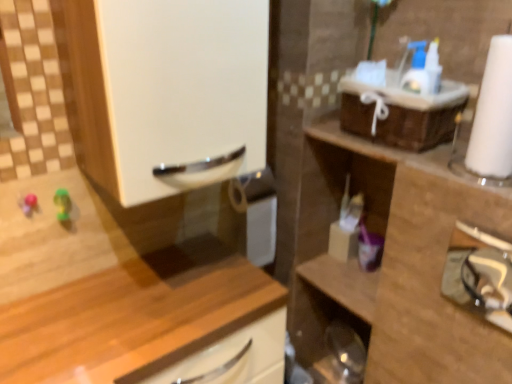
I want to click on translucent plastic container at center-right, which appears as the first toiletry when viewed from the left, so click(346, 228).

In the scene shown: What is the approximate height of metallic silver hairdryer at right?

It is 6.65 inches.

Locate an element on the screen. white glossy cabinet handle at upper left is located at coordinates (183, 91).

At what (x,y) coordinates should I click in order to perform the action: click on purple plastic toothbrush at center-right, arranged as the first toiletry when viewed from the right. Please return your answer as a coordinate pair (x, y). The width and height of the screenshot is (512, 384). Looking at the image, I should click on (369, 248).

At what (x,y) coordinates should I click in order to perform the action: click on translucent plastic container at center-right, which is counted as the second toiletry, starting from the right. Please return your answer as a coordinate pair (x, y). This screenshot has width=512, height=384. Looking at the image, I should click on (346, 228).

What's the angular difference between white glossy cabinet handle at upper left and wooden cabinet at lower left, marked as the first cabinetry in a left-to-right arrangement,'s facing directions?

The angle between the facing direction of white glossy cabinet handle at upper left and the facing direction of wooden cabinet at lower left, marked as the first cabinetry in a left-to-right arrangement, is 0.333 degrees.

In the image, is white glossy cabinet handle at upper left on the left side or the right side of wooden cabinet at lower left, marked as the first cabinetry in a left-to-right arrangement?

white glossy cabinet handle at upper left is to the right of wooden cabinet at lower left, marked as the first cabinetry in a left-to-right arrangement.

Who is bigger, white glossy cabinet handle at upper left or wooden cabinet at lower left, the second cabinetry in the right-to-left sequence?

Bigger between the two is wooden cabinet at lower left, the second cabinetry in the right-to-left sequence.

From a real-world perspective, starting from the white glossy cabinet handle at upper left, which cabinetry is the 2nd one below it? Please provide its 2D coordinates.

[(127, 293)]

From the picture: Is translucent plastic container at center-right, which is counted as the second toiletry, starting from the right, at the back of metallic silver hairdryer at right?

No, translucent plastic container at center-right, which is counted as the second toiletry, starting from the right, is not at the back of metallic silver hairdryer at right.

Is point (507, 269) closer to camera compared to point (344, 247)?

Yes, point (507, 269) is in front of point (344, 247).

From a real-world perspective, between metallic silver hairdryer at right and translucent plastic container at center-right, which is counted as the second toiletry, starting from the right, who is vertically higher?

metallic silver hairdryer at right is physically above.

From the image's perspective, which is above, metallic silver hairdryer at right or translucent plastic container at center-right, which appears as the first toiletry when viewed from the left?

translucent plastic container at center-right, which appears as the first toiletry when viewed from the left, appears higher in the image.

Is wooden cabinet at right, which is counted as the first cabinetry, starting from the right, turned away from white glossy cabinet handle at upper left?

No, white glossy cabinet handle at upper left is not at the back of wooden cabinet at right, which is counted as the first cabinetry, starting from the right.

Is wooden cabinet at right, which is counted as the first cabinetry, starting from the right, outside of white glossy cabinet handle at upper left?

wooden cabinet at right, which is counted as the first cabinetry, starting from the right, is positioned outside white glossy cabinet handle at upper left.

Looking at this image, considering the positions of objects wooden cabinet at right, which is counted as the first cabinetry, starting from the right, and white glossy cabinet handle at upper left in the image provided, who is more to the right, wooden cabinet at right, which is counted as the first cabinetry, starting from the right, or white glossy cabinet handle at upper left?

From the viewer's perspective, wooden cabinet at right, which is counted as the first cabinetry, starting from the right, appears more on the right side.

From the image's perspective, is wooden cabinet at right, acting as the second cabinetry starting from the left, below white glossy cabinet handle at upper left?

Yes, from the image's perspective, wooden cabinet at right, acting as the second cabinetry starting from the left, is beneath white glossy cabinet handle at upper left.

Between purple plastic toothbrush at center-right, which is counted as the second toiletry, starting from the left, and metallic silver hairdryer at right, which one is positioned behind?

purple plastic toothbrush at center-right, which is counted as the second toiletry, starting from the left, is more distant.

Are purple plastic toothbrush at center-right, arranged as the first toiletry when viewed from the right, and metallic silver hairdryer at right beside each other?

No, purple plastic toothbrush at center-right, arranged as the first toiletry when viewed from the right, is not with metallic silver hairdryer at right.

Measure the distance from purple plastic toothbrush at center-right, arranged as the first toiletry when viewed from the right, to metallic silver hairdryer at right.

The distance of purple plastic toothbrush at center-right, arranged as the first toiletry when viewed from the right, from metallic silver hairdryer at right is 10.89 inches.

Considering the relative sizes of metallic silver hairdryer at right and white glossy cabinet handle at upper left in the image provided, is metallic silver hairdryer at right thinner than white glossy cabinet handle at upper left?

Indeed, metallic silver hairdryer at right has a lesser width compared to white glossy cabinet handle at upper left.

Would you say metallic silver hairdryer at right is outside white glossy cabinet handle at upper left?

That's correct, metallic silver hairdryer at right is outside of white glossy cabinet handle at upper left.

Is metallic silver hairdryer at right beside white glossy cabinet handle at upper left?

No, metallic silver hairdryer at right is not in contact with white glossy cabinet handle at upper left.

Can you tell me how much metallic silver hairdryer at right and white glossy cabinet handle at upper left differ in facing direction?

88.1 degrees.

From the image's perspective, which is above, wooden cabinet at lower left, the second cabinetry in the right-to-left sequence, or purple plastic toothbrush at center-right, arranged as the first toiletry when viewed from the right?

From the image's view, purple plastic toothbrush at center-right, arranged as the first toiletry when viewed from the right, is above.

Considering the relative positions of wooden cabinet at lower left, marked as the first cabinetry in a left-to-right arrangement, and purple plastic toothbrush at center-right, arranged as the first toiletry when viewed from the right, in the image provided, is wooden cabinet at lower left, marked as the first cabinetry in a left-to-right arrangement, in front of purple plastic toothbrush at center-right, arranged as the first toiletry when viewed from the right,?

Yes, wooden cabinet at lower left, marked as the first cabinetry in a left-to-right arrangement, is closer to the camera.

From a real-world perspective, which toiletry is the 2nd one above the wooden cabinet at lower left, the second cabinetry in the right-to-left sequence? Please provide its 2D coordinates.

[(369, 248)]

Is point (335, 258) behind point (452, 290)?

No, (335, 258) is closer to viewer.

From a real-world perspective, is translucent plastic container at center-right, which is counted as the second toiletry, starting from the right, above or below metallic silver hairdryer at right?

In terms of real-world spatial position, translucent plastic container at center-right, which is counted as the second toiletry, starting from the right, is below metallic silver hairdryer at right.

Is translucent plastic container at center-right, which is counted as the second toiletry, starting from the right, placed right next to metallic silver hairdryer at right?

No, translucent plastic container at center-right, which is counted as the second toiletry, starting from the right, is not touching metallic silver hairdryer at right.

Is translucent plastic container at center-right, which is counted as the second toiletry, starting from the right, taller than metallic silver hairdryer at right?

Incorrect, the height of translucent plastic container at center-right, which is counted as the second toiletry, starting from the right, is not larger of that of metallic silver hairdryer at right.

Find the location of a particular element. This screenshot has height=384, width=512. cabinetry in front of the white glossy cabinet handle at upper left is located at coordinates (127, 293).

Identify the location of shelf below the translucent plastic container at center-right, which appears as the first toiletry when viewed from the left (from the image's perspective). (481, 275).

Considering their positions, is white glossy cabinet handle at upper left positioned further to wooden cabinet at lower left, the second cabinetry in the right-to-left sequence, than purple plastic toothbrush at center-right, which is counted as the second toiletry, starting from the left?

purple plastic toothbrush at center-right, which is counted as the second toiletry, starting from the left, is positioned further to the anchor wooden cabinet at lower left, the second cabinetry in the right-to-left sequence.

Consider the image. Based on their spatial positions, is translucent plastic container at center-right, which appears as the first toiletry when viewed from the left, or white glossy cabinet handle at upper left closer to wooden cabinet at right, acting as the second cabinetry starting from the left?

Among the two, translucent plastic container at center-right, which appears as the first toiletry when viewed from the left, is located nearer to wooden cabinet at right, acting as the second cabinetry starting from the left.

From the image, which object appears to be nearer to metallic silver hairdryer at right, purple plastic toothbrush at center-right, which is counted as the second toiletry, starting from the left, or wooden cabinet at lower left, marked as the first cabinetry in a left-to-right arrangement?

purple plastic toothbrush at center-right, which is counted as the second toiletry, starting from the left, lies closer to metallic silver hairdryer at right than the other object.

Based on their spatial positions, is wooden cabinet at right, which is counted as the first cabinetry, starting from the right, or translucent plastic container at center-right, which appears as the first toiletry when viewed from the left, further from purple plastic toothbrush at center-right, arranged as the first toiletry when viewed from the right?

wooden cabinet at right, which is counted as the first cabinetry, starting from the right.

From the image, which object appears to be farther from white glossy cabinet handle at upper left, translucent plastic container at center-right, which is counted as the second toiletry, starting from the right, or metallic silver hairdryer at right?

translucent plastic container at center-right, which is counted as the second toiletry, starting from the right.

Based on their spatial positions, is purple plastic toothbrush at center-right, arranged as the first toiletry when viewed from the right, or metallic silver hairdryer at right further from wooden cabinet at lower left, marked as the first cabinetry in a left-to-right arrangement?

metallic silver hairdryer at right.

Based on their spatial positions, is white glossy cabinet handle at upper left or wooden cabinet at lower left, marked as the first cabinetry in a left-to-right arrangement, further from translucent plastic container at center-right, which appears as the first toiletry when viewed from the left?

white glossy cabinet handle at upper left.

Which object lies further to the anchor point translucent plastic container at center-right, which appears as the first toiletry when viewed from the left, wooden cabinet at right, which is counted as the first cabinetry, starting from the right, or metallic silver hairdryer at right?

The object further to translucent plastic container at center-right, which appears as the first toiletry when viewed from the left, is metallic silver hairdryer at right.

At what (x,y) coordinates should I click in order to perform the action: click on cabinetry between white glossy cabinet handle at upper left and metallic silver hairdryer at right in the horizontal direction. Please return your answer as a coordinate pair (x, y). Looking at the image, I should click on (394, 261).

Locate an element on the screen. This screenshot has height=384, width=512. toiletry positioned between metallic silver hairdryer at right and translucent plastic container at center-right, which appears as the first toiletry when viewed from the left, from near to far is located at coordinates (369, 248).

Where is `cabinetry positioned between white glossy cabinet handle at upper left and purple plastic toothbrush at center-right, which is counted as the second toiletry, starting from the left, from near to far`? Image resolution: width=512 pixels, height=384 pixels. cabinetry positioned between white glossy cabinet handle at upper left and purple plastic toothbrush at center-right, which is counted as the second toiletry, starting from the left, from near to far is located at coordinates (x=394, y=261).

Identify the location of cabinetry that lies between white glossy cabinet handle at upper left and wooden cabinet at lower left, marked as the first cabinetry in a left-to-right arrangement, from top to bottom. (394, 261).